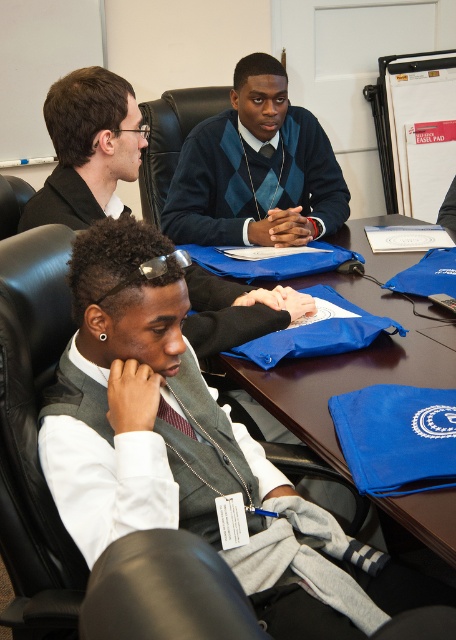
You are a delivery person who needs to place a blue fabric bag at center on the table. The table is located at point (348, 365). Is there enough space to place the bag without disturbing the people seated around the table?

The blue fabric bag at center is already located at point (348, 365) on the table, so placing it there would not require moving anyone since it is already present.

You are a photographer standing in the room and want to take a closeup photo of the dark blue argyle sweater at center. If your camera has a maximum focus range of 2 meters, will you be able to focus on the sweater without moving closer?

The dark blue argyle sweater at center is 2.06 meters away from the viewer. Since the camera can only focus up to 2 meters, it will not be able to focus on the sweater without moving closer.

You are an observer in the meeting room. You notice two items at the center of the table. One is the dark blue argyle sweater at center and the other is the gray vest at center. Which item is taller?

The dark blue argyle sweater at center is taller than the gray vest at center.